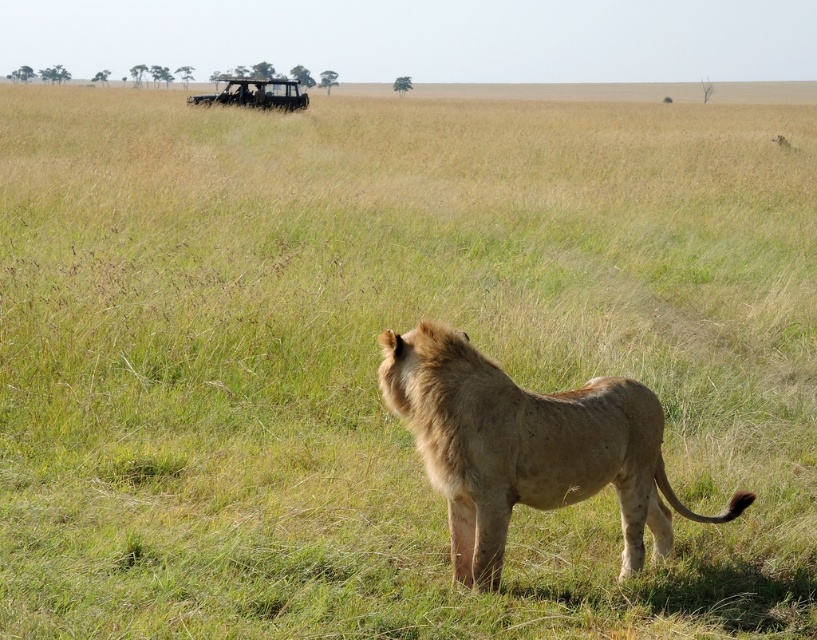
You are a wildlife photographer planning to take a photo of the golden fur lion at center and the metallic silver jeep at upper center. You want to ensure both subjects are clearly visible. Based on their sizes, which subject should you focus on first to ensure proper framing?

The golden fur lion at center has a smaller size compared to the metallic silver jeep at upper center. Therefore, you should focus on the golden fur lion at center first to ensure it is properly framed before adjusting for the larger jeep.

Based on the photo, you are a safari guide standing near the metallic silver jeep at upper center. You want to show your guests the golden fur lion at center. Which direction should you point to locate the lion?

The golden fur lion at center is to the right of the metallic silver jeep at upper center, so you should point to the right to locate the lion.

You are a wildlife photographer planning to capture a photo of the golden fur lion at center and the metallic silver jeep at upper center in the same frame. Based on their sizes in the image, which one appears narrower?

The golden fur lion at center appears narrower than the metallic silver jeep at upper center.